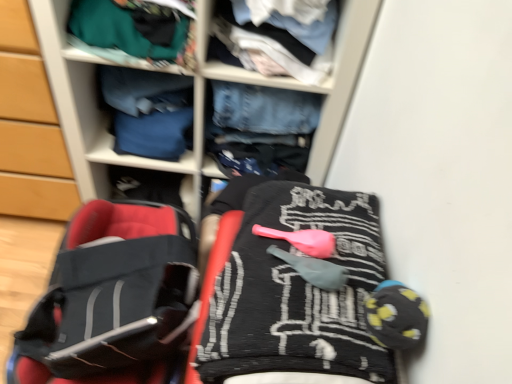
Question: Does teal fabric at upper left, the second clothing from the back, contain black fabric baby carriage at lower left?

Choices:
 (A) no
 (B) yes

Answer: (A)

Question: Considering the relative sizes of teal fabric at upper left, the second clothing from the back, and black fabric baby carriage at lower left in the image provided, is teal fabric at upper left, the second clothing from the back, taller than black fabric baby carriage at lower left?

Choices:
 (A) no
 (B) yes

Answer: (A)

Question: Can you confirm if teal fabric at upper left, the second clothing from the back, is smaller than black fabric baby carriage at lower left?

Choices:
 (A) yes
 (B) no

Answer: (A)

Question: Considering the relative positions of teal fabric at upper left, which ranks as the third clothing in front-to-back order, and black fabric baby carriage at lower left in the image provided, is teal fabric at upper left, which ranks as the third clothing in front-to-back order, to the right of black fabric baby carriage at lower left from the viewer's perspective?

Choices:
 (A) yes
 (B) no

Answer: (A)

Question: Is teal fabric at upper left, which ranks as the third clothing in front-to-back order, shorter than black fabric baby carriage at lower left?

Choices:
 (A) no
 (B) yes

Answer: (B)

Question: From the image's perspective, is teal fabric at upper left, which ranks as the third clothing in front-to-back order, under black fabric baby carriage at lower left?

Choices:
 (A) yes
 (B) no

Answer: (B)

Question: Can you confirm if wooden cabinet at left is positioned to the left of denim jeans at center?

Choices:
 (A) no
 (B) yes

Answer: (B)

Question: Considering the relative positions of wooden cabinet at left and denim jeans at center in the image provided, is wooden cabinet at left to the right of denim jeans at center from the viewer's perspective?

Choices:
 (A) yes
 (B) no

Answer: (B)

Question: Is wooden cabinet at left positioned beyond the bounds of denim jeans at center?

Choices:
 (A) no
 (B) yes

Answer: (B)

Question: Would you say denim jeans at center is part of wooden cabinet at left's contents?

Choices:
 (A) yes
 (B) no

Answer: (B)

Question: Is wooden cabinet at left smaller than denim jeans at center?

Choices:
 (A) yes
 (B) no

Answer: (A)

Question: From a real-world perspective, is wooden cabinet at left positioned under denim jeans at center based on gravity?

Choices:
 (A) yes
 (B) no

Answer: (A)

Question: Can you confirm if black textured blanket at center, the fourth clothing in the back-to-front sequence, is smaller than denim jeans at center?

Choices:
 (A) no
 (B) yes

Answer: (B)